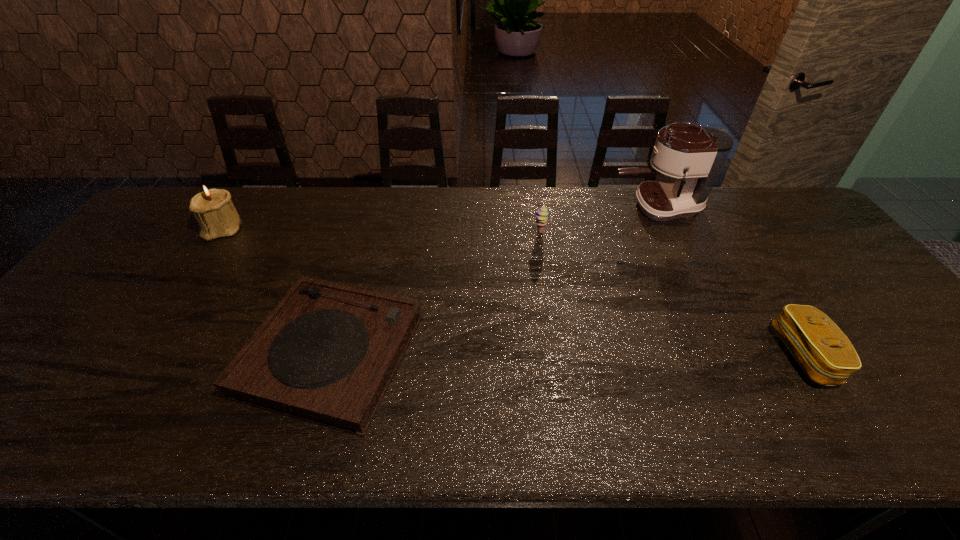
Locate an element on the screen. The image size is (960, 540). vacant area that lies between the clutch bag and the tallest object is located at coordinates (731, 281).

Find the location of a particular element. The image size is (960, 540). empty location between the tallest object and the shortest object is located at coordinates (493, 281).

Where is `free space between the clutch bag and the shortest object`? This screenshot has width=960, height=540. free space between the clutch bag and the shortest object is located at coordinates (567, 355).

Where is `object that is the closest to the clutch bag`? object that is the closest to the clutch bag is located at coordinates (694, 155).

At what (x,y) coordinates should I click in order to perform the action: click on object that is the second closest one to the phonograph record. Please return your answer as a coordinate pair (x, y). Image resolution: width=960 pixels, height=540 pixels. Looking at the image, I should click on pyautogui.click(x=541, y=215).

Find the location of a particular element. The image size is (960, 540). vacant point that satisfies the following two spatial constraints: 1. on the front-facing side of the coffee maker; 2. on the front side of the phonograph record is located at coordinates (730, 354).

Where is `vacant space that satisfies the following two spatial constraints: 1. on the front-facing side of the coffee maker; 2. on the front side of the candle_holder`? vacant space that satisfies the following two spatial constraints: 1. on the front-facing side of the coffee maker; 2. on the front side of the candle_holder is located at coordinates (667, 229).